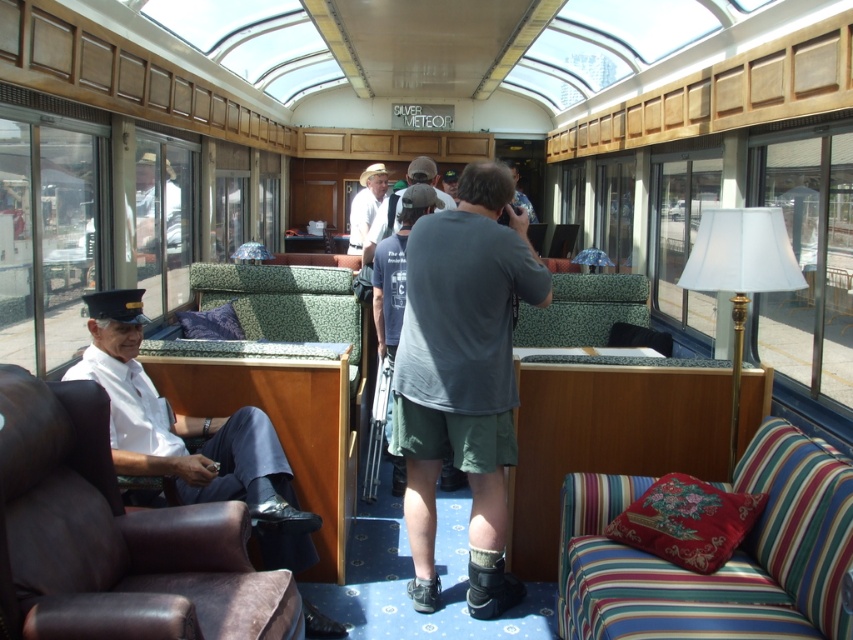
Question: Which object is farther from the camera taking this photo?

Choices:
 (A) striped fabric couch at lower right
 (B) matte white shirt at center

Answer: (B)

Question: Is brown leather couch at left to the left of dark gray cotton t-shirt at center from the viewer's perspective?

Choices:
 (A) no
 (B) yes

Answer: (B)

Question: Which object is the closest to the striped fabric couch at lower right?

Choices:
 (A) white fabric lampshade at right
 (B) dark gray cotton t-shirt at center

Answer: (A)

Question: Can you confirm if dark gray cotton t-shirt at center is smaller than green floral fabric couch at center?

Choices:
 (A) yes
 (B) no

Answer: (B)

Question: Which point is closer to the camera?

Choices:
 (A) (380, 332)
 (B) (766, 285)
 (C) (643, 308)

Answer: (B)

Question: Is white fabric lampshade at right positioned in front of white shirt at center?

Choices:
 (A) yes
 (B) no

Answer: (A)